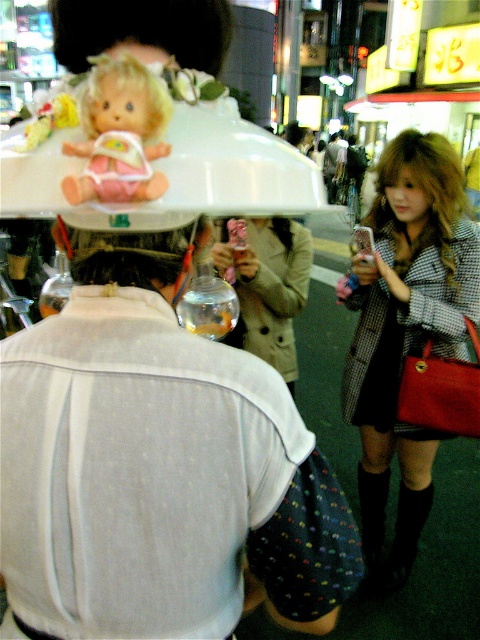
Question: Which point is farther from the camera taking this photo?

Choices:
 (A) (181, 256)
 (B) (130, 97)

Answer: (A)

Question: Does brown leather hair at center appear on the left side of blonde hair doll at upper center?

Choices:
 (A) yes
 (B) no

Answer: (A)

Question: Does plaid wool coat at center right have a lesser width compared to blonde hair doll at upper center?

Choices:
 (A) no
 (B) yes

Answer: (A)

Question: Can you confirm if matte plastic doll at upper left is thinner than blonde hair doll at upper center?

Choices:
 (A) yes
 (B) no

Answer: (A)

Question: Which point is farther from the camera taking this photo?

Choices:
 (A) (350, 292)
 (B) (288, 289)

Answer: (B)

Question: Based on their relative distances, which object is nearer to the shiny blonde hair at center?

Choices:
 (A) blonde hair doll at upper center
 (B) tan leather jacket at center

Answer: (B)